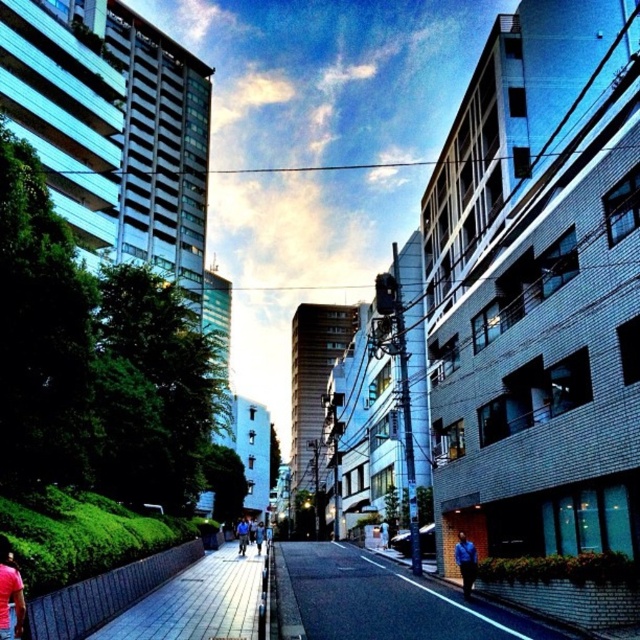
You are a delivery person standing on the paved stone sidewalk at center and need to place a package on the matte red shirt at lower left. Can you reach the shirt without stepping off the sidewalk?

The paved stone sidewalk at center is higher than the matte red shirt at lower left, so yes, you can reach the shirt without stepping off the sidewalk because the sidewalk is elevated above the shirt.

You are a photographer standing at point (x=10, y=593). You want to capture the modern building on the left side of the image. Is the matte red shirt at lower left blocking your view of the modern building?

The matte red shirt at lower left is located at point (x=10, y=593), which is your current position. Since you are standing at that point, the matte red shirt at lower left would be in your immediate vicinity, potentially blocking your view of the modern building on the left depending on its size and orientation. However, the description does not provide specific details about the shirt obstructing the view, so it cannot be confirmed definitively.